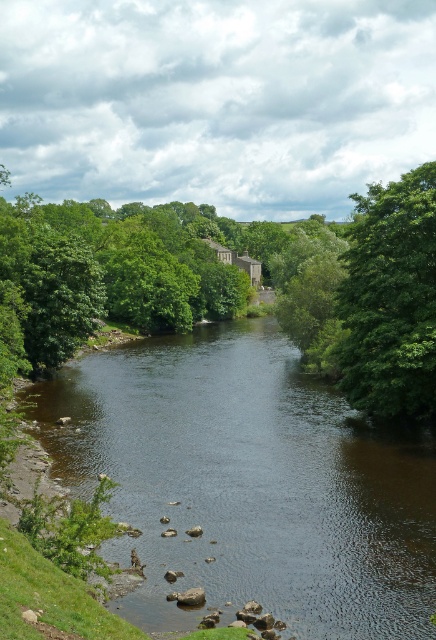
You are a hiker who wants to cross the river using a 30 feet long rope. You see the dark brown water at center and the green leafy tree at upper right. Can you safely use the rope to cross the river between these two points?

The dark brown water at center and green leafy tree at upper right are 35.01 feet apart from each other. Since the rope is only 30 feet long, it is not long enough to safely cross the river between these two points.

You are a photographer standing at the camera position. You want to capture a closeup of the dark brown water at center. Can you reach it by walking straight ahead without crossing the stone bridge?

The dark brown water at center and camera are 15.34 meters apart, so yes, you can reach the dark brown water at center by walking straight ahead since the distance is manageable without needing to cross the stone bridge.

You are standing on the stone bridge spanning the river and notice a point marked at coordinates (x=248, y=483). What color is the water at that specific location?

The water at the point marked (x=248, y=483) is dark brown.